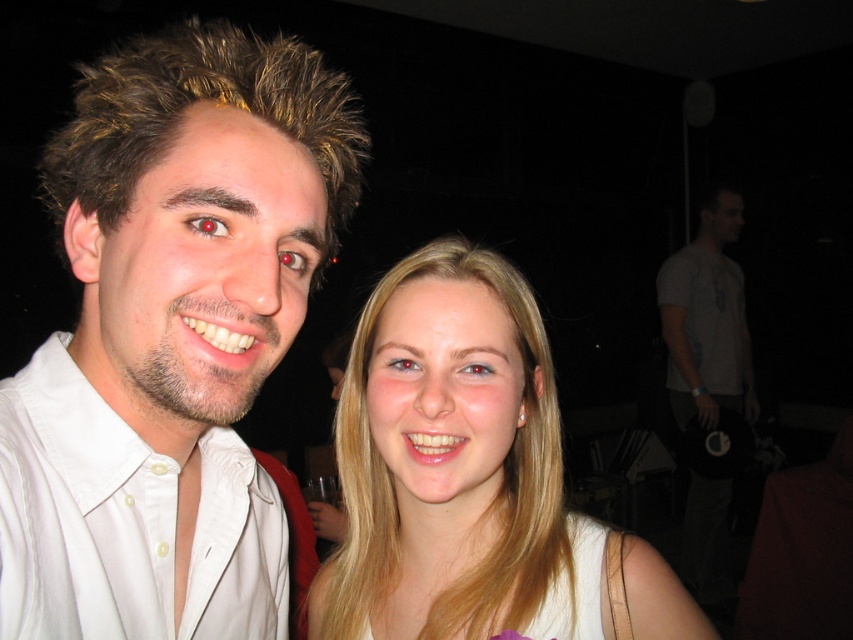
You are taking a photo of two people standing in front of you. You notice two points marked on the photo at coordinates point (457, 387) and point (151, 490). If you want to focus on the closer point to ensure the photo is sharp, which coordinate should you choose?

Point (457, 387) is further to the camera than point (151, 490), so to focus on the closer point, you should choose point (151, 490).

You are a photographer trying to adjust the focus of your camera. You want to focus on the blonde hair at center and the white cotton shirt at left. Which object should you focus on first to ensure both are in focus?

The blonde hair at center is further to the viewer than the white cotton shirt at left, so you should focus on the blonde hair at center first to ensure both are in focus.